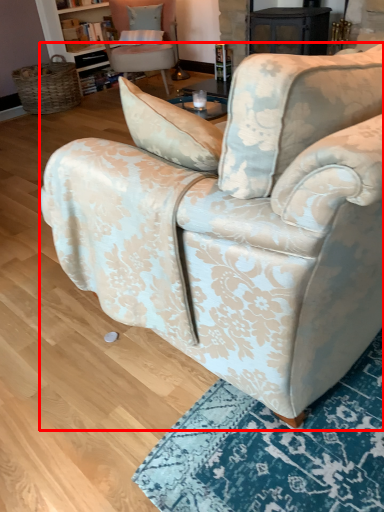
Question: From the image, what is the correct spatial relationship of chair (annotated by the red box) in relation to chair?

Choices:
 (A) right
 (B) left

Answer: (A)